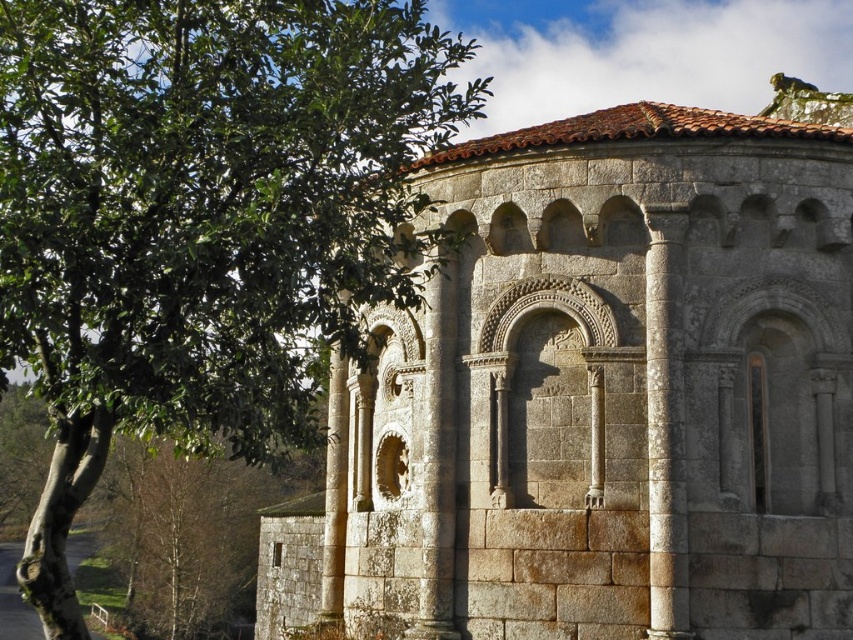
You are a photographer standing in front of the historic stone building. You want to capture a clear view of the entire Romanesque apse without any obstructions. Based on the green leafy tree at upper left, what adjustment should you make to your position?

The green leafy tree at upper left is located at point (202, 220), so to avoid obstruction, you should move to the right or lower your camera angle to frame the apse without the tree blocking the view.

You are a photographer aiming to capture the gray stone building at center without the green leafy tree at upper left blocking it. Based on their heights, which one would you need to adjust your camera angle upwards or downwards to focus on the building?

The gray stone building at center is not as tall as the green leafy tree at upper left, so you would need to lower your camera angle to focus on the building without the tree blocking it.

In the scene shown: You are an architect assessing the historic building. You notice the green leafy tree at upper left and the gray stone column at center. Which object has a greater width?

The green leafy tree at upper left has a greater width than the gray stone column at center.